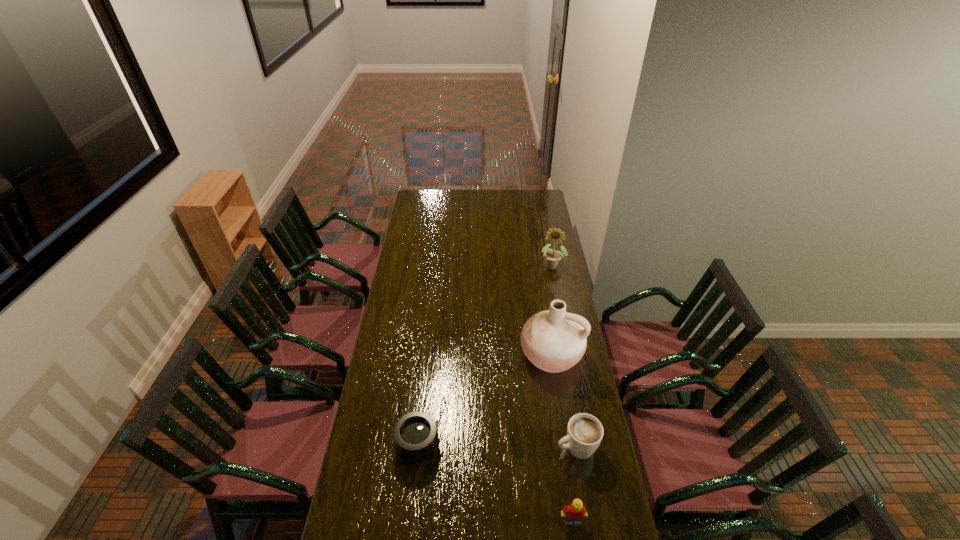
Locate an element on the screen. The width and height of the screenshot is (960, 540). vacant area located on the front-facing side of the farthest object is located at coordinates tap(537, 311).

At what (x,y) coordinates should I click in order to perform the action: click on free space located on the front-facing side of the farthest object. Please return your answer as a coordinate pair (x, y). The image size is (960, 540). Looking at the image, I should click on (531, 327).

The height and width of the screenshot is (540, 960). I want to click on free spot located on the front-facing side of the farthest object, so coord(538,308).

This screenshot has height=540, width=960. I want to click on vacant space located 0.120m to pour from the handle of the pottery, so click(x=531, y=402).

At what (x,y) coordinates should I click in order to perform the action: click on free region located 0.050m to pour from the handle of the pottery. Please return your answer as a coordinate pair (x, y). The height and width of the screenshot is (540, 960). Looking at the image, I should click on (537, 389).

In order to click on free spot located to pour from the handle of the pottery in this screenshot , I will do `click(507, 460)`.

This screenshot has width=960, height=540. Identify the location of object present at the near edge. (573, 514).

The image size is (960, 540). Identify the location of object located in the left edge section of the desktop. (415, 434).

At what (x,y) coordinates should I click in order to perform the action: click on Lego that is at the right edge. Please return your answer as a coordinate pair (x, y). The height and width of the screenshot is (540, 960). Looking at the image, I should click on (573, 514).

Where is `cappuccino present at the right edge`? The image size is (960, 540). cappuccino present at the right edge is located at coordinates (584, 431).